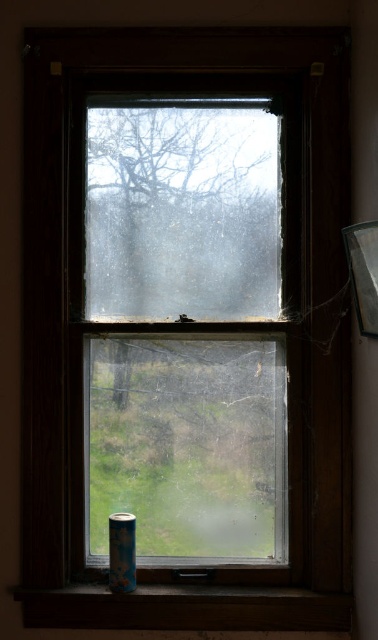
Is transparent glass window at center closer to camera compared to wooden at lower center?

No.

Which is behind, point (159, 310) or point (350, 600)?

Point (159, 310)

The image size is (378, 640). Identify the location of transparent glass window at center. (182, 212).